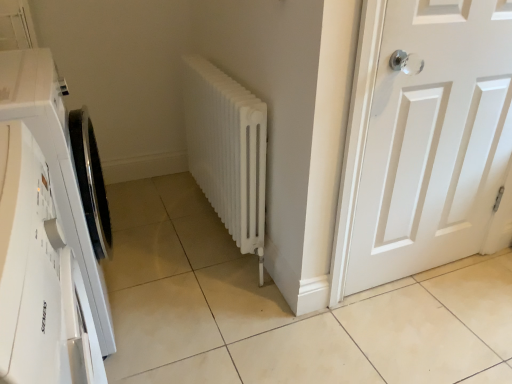
This screenshot has width=512, height=384. What are the coordinates of `free location in front of white matte radiator at center` in the screenshot? It's located at pos(220,306).